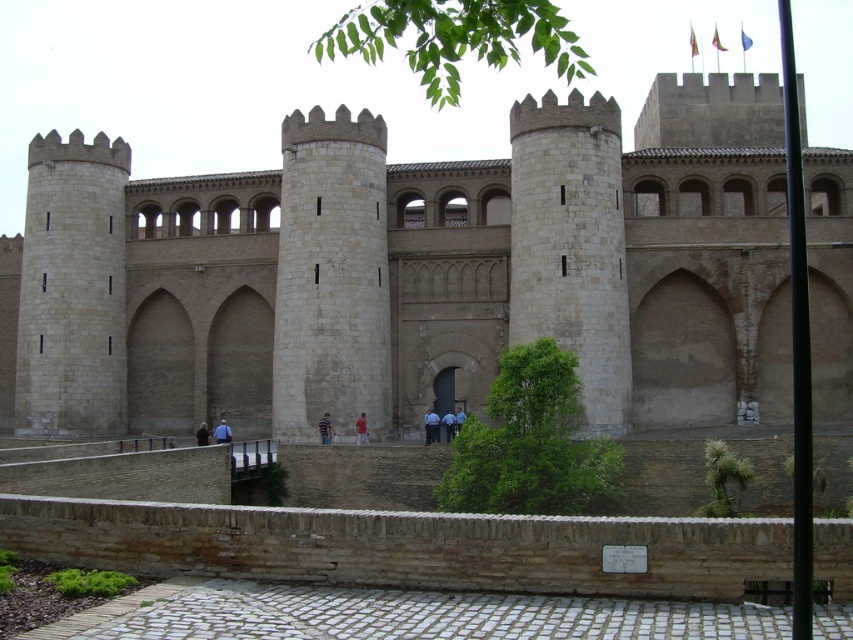
Question: Where is beige stone castle at center located in relation to light blue uniform at center in the image?

Choices:
 (A) below
 (B) above

Answer: (B)

Question: Which point is closer to the camera taking this photo?

Choices:
 (A) (463, 417)
 (B) (437, 420)

Answer: (B)

Question: Is beige stone castle at center to the right of white stone tower at center from the viewer's perspective?

Choices:
 (A) no
 (B) yes

Answer: (B)

Question: Based on their relative distances, which object is farther from the light blue uniform at center?

Choices:
 (A) white stone tower at center
 (B) blue denim jeans at center

Answer: (B)

Question: Which point is farther to the camera?

Choices:
 (A) (445, 435)
 (B) (325, 419)
 (C) (463, 390)

Answer: (C)

Question: Can you confirm if white stone tower at center is positioned above striped cotton shirt at center?

Choices:
 (A) no
 (B) yes

Answer: (B)